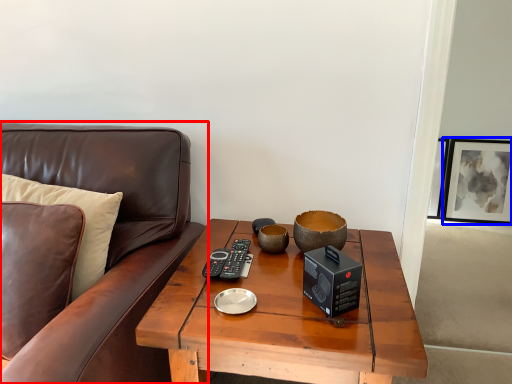
Question: Which object appears closest to the camera in this image, studio couch (highlighted by a red box) or picture frame (highlighted by a blue box)?

Choices:
 (A) studio couch
 (B) picture frame

Answer: (A)